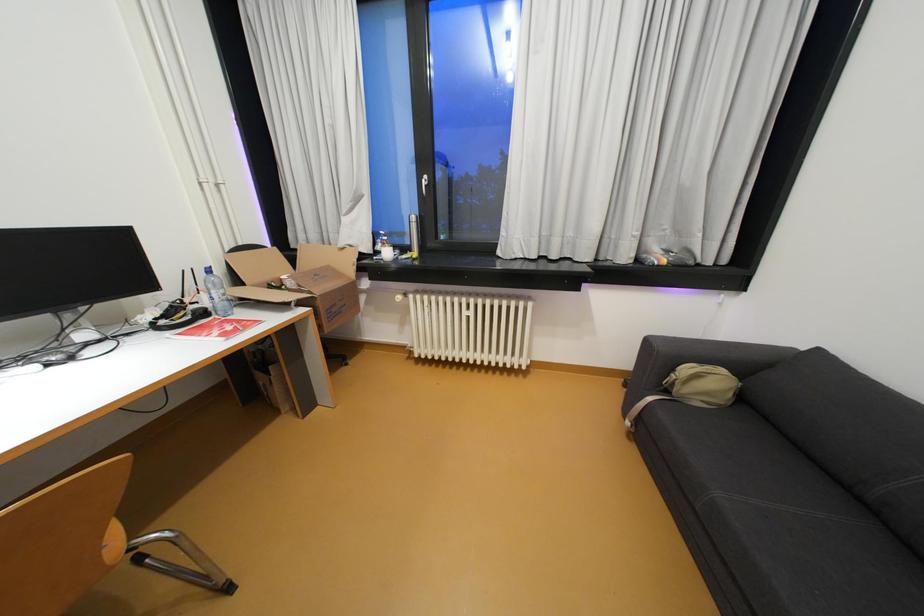
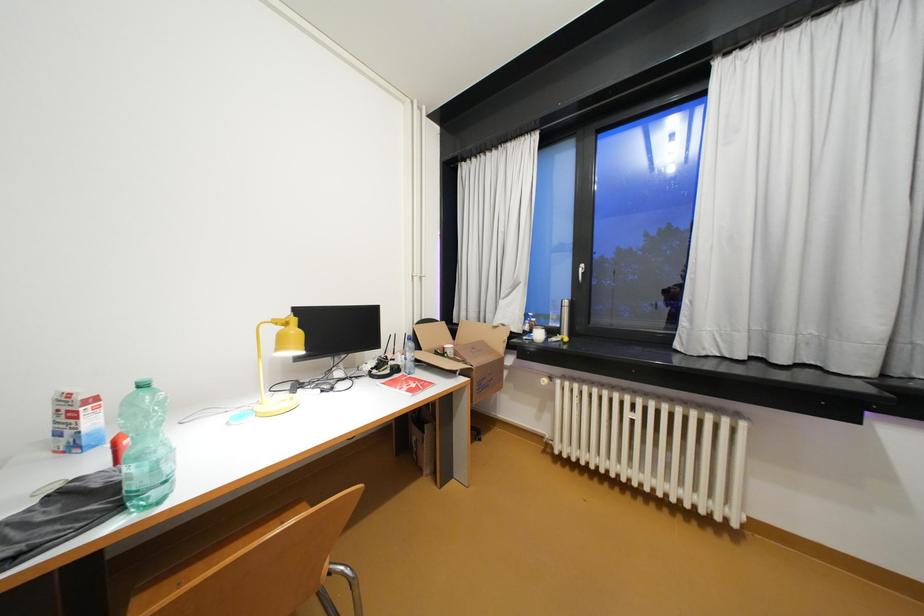
Question: The camera is either moving clockwise (left) or counter-clockwise (right) around the object. The first image is from the beginning of the video and the second image is from the end. Is the camera moving left or right when shooting the video?

Choices:
 (A) Left
 (B) Right

Answer: (B)